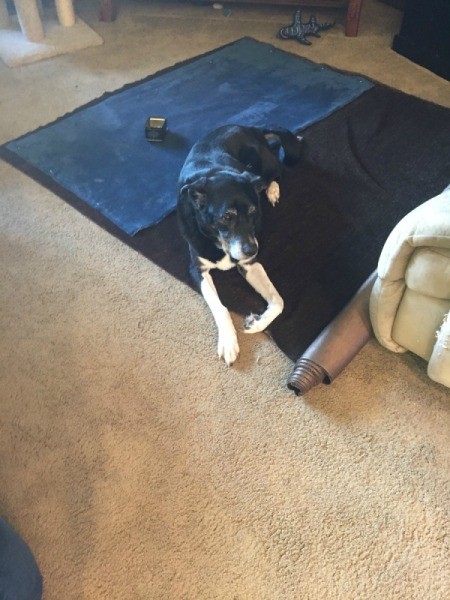
I want to click on blue and black blanket, so click(278, 86), click(347, 145).